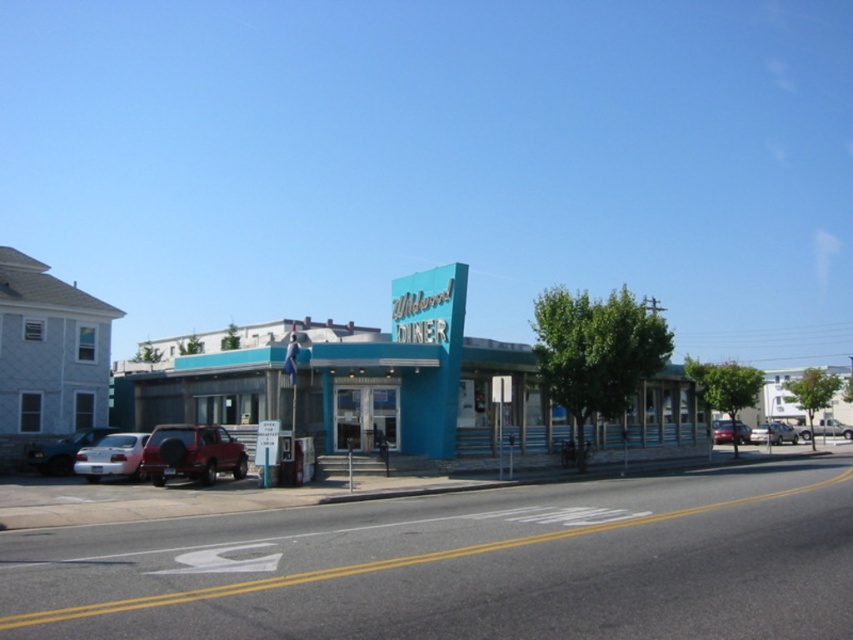
Question: Where is silver metallic sedan at lower left located in relation to metallic silver sedan at center in the image?

Choices:
 (A) left
 (B) right

Answer: (A)

Question: Where is matte silver suv at left located in relation to metallic silver sedan at center in the image?

Choices:
 (A) above
 (B) below

Answer: (A)

Question: Does teal painted diner at center appear on the right side of metallic red suv at center-left?

Choices:
 (A) no
 (B) yes

Answer: (B)

Question: Which object is closer to the camera taking this photo?

Choices:
 (A) matte silver suv at left
 (B) metallic red suv at center-left
 (C) silver metallic sedan at lower left
 (D) metallic silver truck at center

Answer: (B)

Question: Which of the following is the farthest from the observer?

Choices:
 (A) metallic silver sedan at center
 (B) teal painted diner at center
 (C) silver metallic sedan at lower left

Answer: (A)

Question: Estimate the real-world distances between objects in this image. Which object is farther from the metallic silver sedan at center?

Choices:
 (A) metallic red car at center
 (B) metallic red suv at center-left
 (C) matte silver suv at left

Answer: (C)